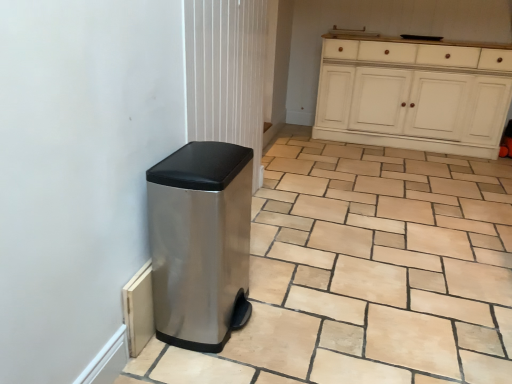
Identify the location of vacant space behind polished stainless steel trash can at lower left. Image resolution: width=512 pixels, height=384 pixels. (252, 262).